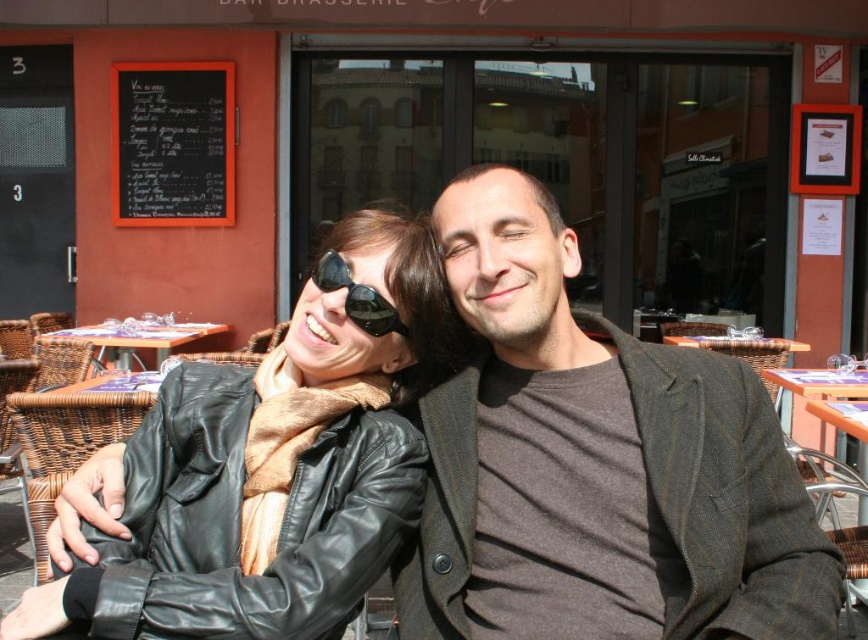
You are a tailor who needs to determine which item is bigger between the black leather jacket at center and the black chalkboard at upper left. Which one is larger?

The black leather jacket at center is larger than the black chalkboard at upper left according to the description.

You are a delivery person standing at the point marked by the coordinates point [353,214]. You need to deliver a package to the entrance of the building. The entrance is 1.58 meters away from your current position. Is the entrance located in the direction of the menu board on the left side of the frame or the red exterior wall?

The entrance is located in the direction of the menu board on the left side of the frame because the distance between the point [353,214] and the entrance is 1.58 meters, which matches the description provided.

You are a photographer trying to capture a closeup of the brown pinstripe blazer at center and the black reflective sunglasses at center. Which object is closer to the camera?

The brown pinstripe blazer at center is positioned under the black reflective sunglasses at center, so the sunglasses are closer to the camera.